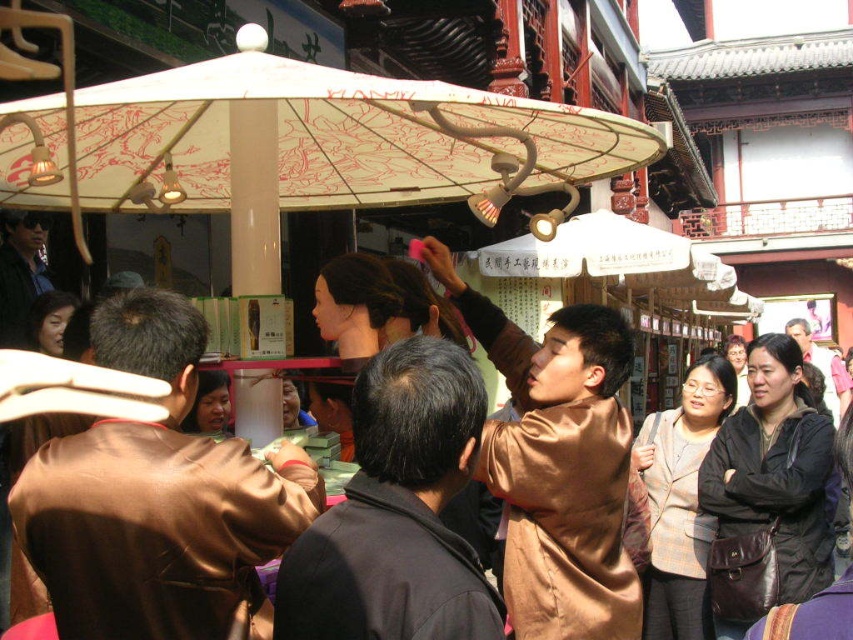
Between brown satin robe at center and brown satin robe at lower right, which one appears on the left side from the viewer's perspective?

brown satin robe at center

Who is taller, brown satin robe at center or brown satin robe at lower right?

brown satin robe at lower right is taller.

Is point (228, 499) positioned after point (695, 564)?

No, it is not.

The width and height of the screenshot is (853, 640). I want to click on brown satin robe at center, so click(158, 531).

Measure the distance between brown leather bag at lower right and brown satin robe at lower right.

brown leather bag at lower right and brown satin robe at lower right are 2.84 meters apart.

Does brown leather bag at lower right have a larger size compared to brown satin robe at lower right?

No.

Is point (764, 596) positioned in front of point (685, 580)?

Yes, point (764, 596) is closer to viewer.

I want to click on brown leather bag at lower right, so click(x=769, y=509).

The height and width of the screenshot is (640, 853). Find the location of `white paper umbrella at upper center`. white paper umbrella at upper center is located at coordinates (300, 147).

Which is more to the left, white paper umbrella at upper center or brown satin robe at lower right?

white paper umbrella at upper center is more to the left.

Between point (102, 113) and point (700, 548), which one is positioned in front?

Positioned in front is point (102, 113).

Where is `white paper umbrella at upper center`? The width and height of the screenshot is (853, 640). white paper umbrella at upper center is located at coordinates (300, 147).